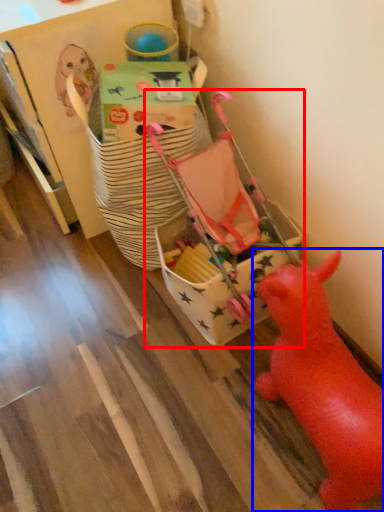
Question: Among these objects, which one is nearest to the camera, toy (highlighted by a red box) or toy (highlighted by a blue box)?

Choices:
 (A) toy
 (B) toy

Answer: (B)